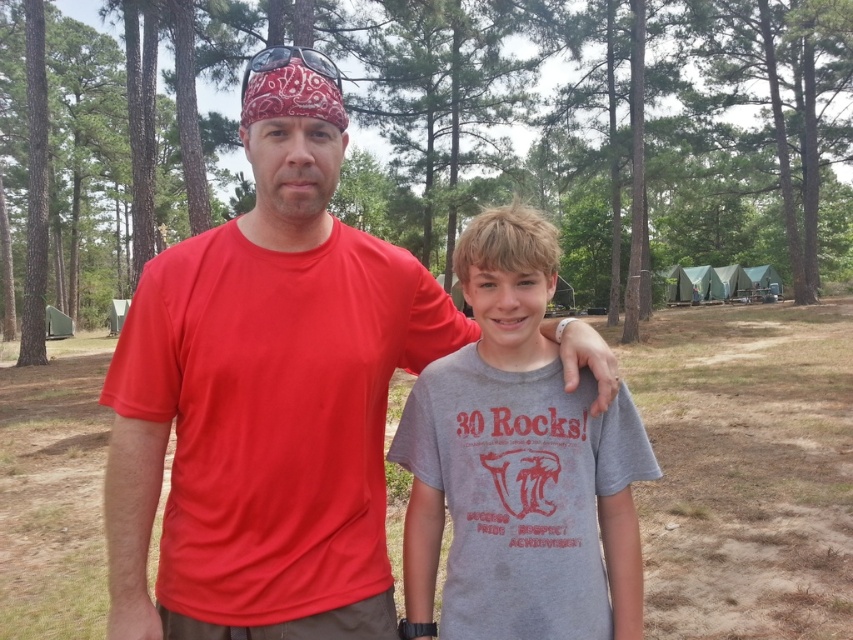
Who is lower down, matte red t-shirt at center or gray cotton t-shirt at center?

Positioned lower is gray cotton t-shirt at center.

Image resolution: width=853 pixels, height=640 pixels. I want to click on matte red t-shirt at center, so click(x=265, y=396).